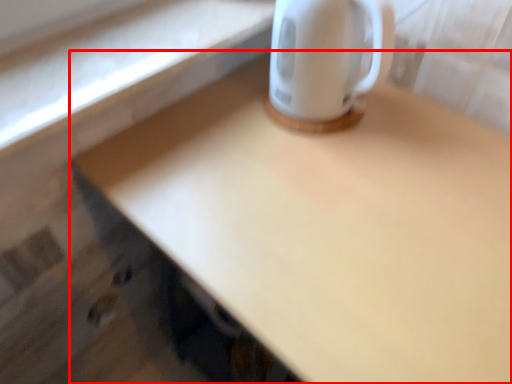
Question: From the image's perspective, where is desk (annotated by the red box) located in relation to coffee cup in the image?

Choices:
 (A) below
 (B) above

Answer: (A)